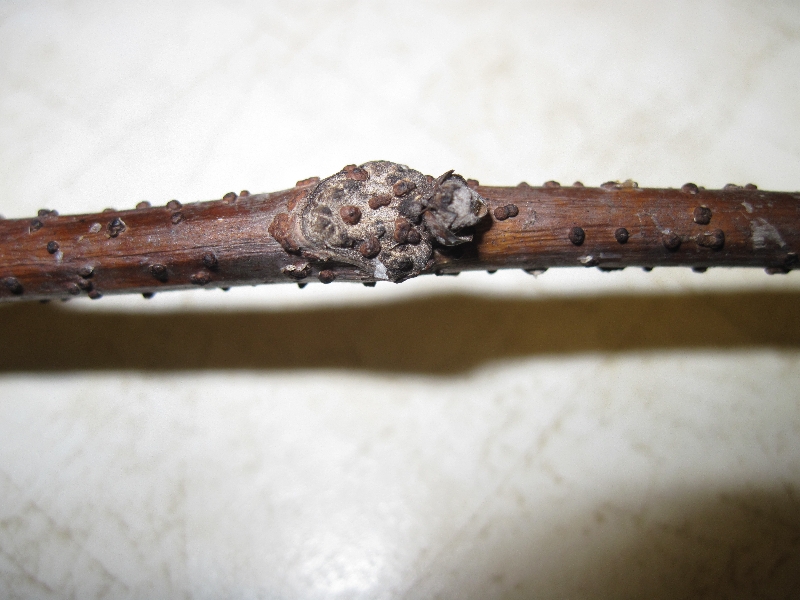
Locate an element on the screen. The width and height of the screenshot is (800, 600). line on tile is located at coordinates (452, 541).